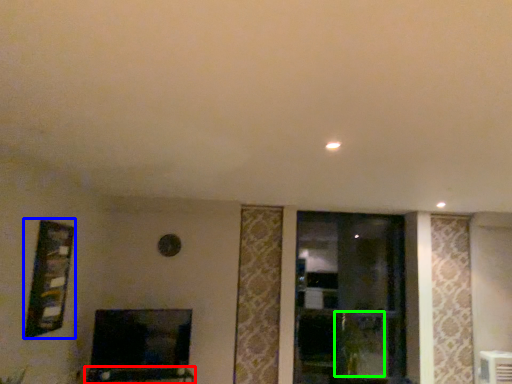
Question: Based on their relative distances, which object is farther from furniture (highlighted by a red box)? Choose from picture frame (highlighted by a blue box) and plant (highlighted by a green box).

Choices:
 (A) picture frame
 (B) plant

Answer: (B)